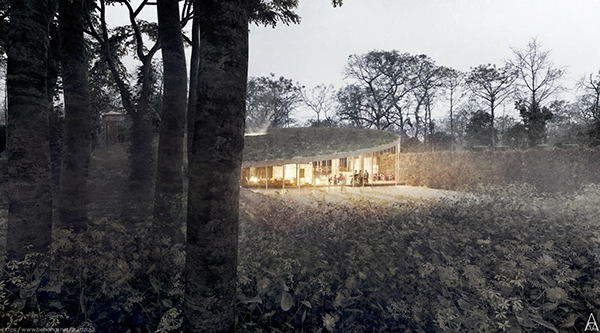
You are a GUI agent. You are given a task and a screenshot of the screen. Output one action in this format:
    pyautogui.click(x=<x>, y=<y>)
    Task: Click on the windows
    This screenshot has height=333, width=600.
    Given the screenshot: What is the action you would take?
    pyautogui.click(x=341, y=161), pyautogui.click(x=328, y=167)